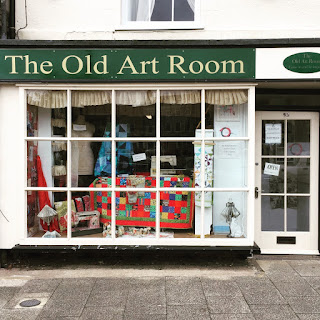
Locate an element on the screen. The image size is (320, 320). sewing machine is located at coordinates (95, 223).